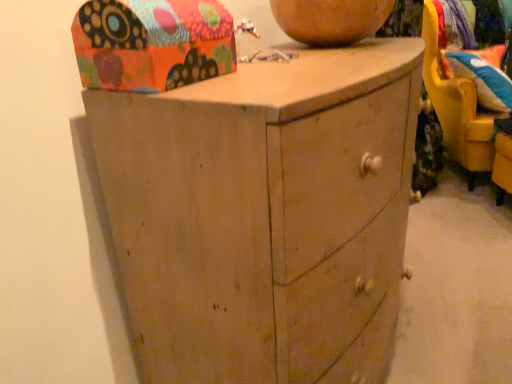
This screenshot has width=512, height=384. Describe the element at coordinates (330, 20) in the screenshot. I see `matte brown vase at upper center` at that location.

What do you see at coordinates (482, 80) in the screenshot? This screenshot has height=384, width=512. I see `velvet blue pillow at right` at bounding box center [482, 80].

Looking at this image, what is the approximate height of matte wood chest of drawers at center?

It is 38.85 inches.

The image size is (512, 384). Describe the element at coordinates (426, 148) in the screenshot. I see `floral fabric cushion at upper right` at that location.

In the scene shown: What is the approximate width of multicolored paper shoe box at upper left?

6.96 inches.

Where is `matte brown vase at upper center`? matte brown vase at upper center is located at coordinates (330, 20).

I want to click on swivel chair that is on the right side of floral fabric cushion at upper right, so click(456, 106).

Based on the photo, is floral fabric cushion at upper right positioned behind yellow plastic swivel chair at right?

No.

Who is bigger, floral fabric cushion at upper right or yellow plastic swivel chair at right?

yellow plastic swivel chair at right.

From the image's perspective, is floral fabric cushion at upper right above or below yellow plastic swivel chair at right?

floral fabric cushion at upper right is below yellow plastic swivel chair at right.

Looking at this image, which object is further away from the camera, floral fabric cushion at upper right or velvet blue pillow at right?

velvet blue pillow at right.

Would you say floral fabric cushion at upper right is a long distance from velvet blue pillow at right?

No.

Is floral fabric cushion at upper right wider or thinner than velvet blue pillow at right?

Considering their sizes, floral fabric cushion at upper right looks slimmer than velvet blue pillow at right.

From a real-world perspective, is matte brown vase at upper center above or below matte wood chest of drawers at center?

matte brown vase at upper center is above matte wood chest of drawers at center.

Is matte brown vase at upper center positioned before matte wood chest of drawers at center?

No, the depth of matte brown vase at upper center is greater than that of matte wood chest of drawers at center.

Considering the relative positions of matte brown vase at upper center and matte wood chest of drawers at center in the image provided, is matte brown vase at upper center to the left of matte wood chest of drawers at center from the viewer's perspective?

No, matte brown vase at upper center is not to the left of matte wood chest of drawers at center.

Where is `pillow behind the multicolored paper shoe box at upper left`? This screenshot has width=512, height=384. pillow behind the multicolored paper shoe box at upper left is located at coordinates (482, 80).

From a real-world perspective, between multicolored paper shoe box at upper left and velvet blue pillow at right, who is vertically higher?

In real-world perspective, multicolored paper shoe box at upper left is above.

Is multicolored paper shoe box at upper left taller or shorter than velvet blue pillow at right?

Considering their sizes, multicolored paper shoe box at upper left has less height than velvet blue pillow at right.

Considering the points (337, 14) and (467, 78), which point is behind, point (337, 14) or point (467, 78)?

Positioned behind is point (467, 78).

Is matte brown vase at upper center oriented away from velvet blue pillow at right?

No, matte brown vase at upper center is not facing away from velvet blue pillow at right.

Who is smaller, matte brown vase at upper center or velvet blue pillow at right?

matte brown vase at upper center.

Does matte brown vase at upper center have a lesser width compared to velvet blue pillow at right?

Indeed, matte brown vase at upper center has a lesser width compared to velvet blue pillow at right.

Does floral fabric cushion at upper right have a smaller size compared to multicolored paper shoe box at upper left?

Incorrect, floral fabric cushion at upper right is not smaller in size than multicolored paper shoe box at upper left.

Based on the photo, in terms of width, does floral fabric cushion at upper right look wider or thinner when compared to multicolored paper shoe box at upper left?

floral fabric cushion at upper right is wider than multicolored paper shoe box at upper left.

Locate an element on the screen. Image resolution: width=512 pixels, height=384 pixels. shoe box in front of the floral fabric cushion at upper right is located at coordinates (152, 43).

Can you confirm if matte wood chest of drawers at center is taller than matte brown vase at upper center?

Indeed, matte wood chest of drawers at center has a greater height compared to matte brown vase at upper center.

What's the angular difference between matte wood chest of drawers at center and matte brown vase at upper center's facing directions?

matte wood chest of drawers at center and matte brown vase at upper center are facing 0.702 degrees away from each other.

Is matte wood chest of drawers at center oriented towards matte brown vase at upper center?

No.

Identify the location of the chest of drawers in front of the matte brown vase at upper center. (264, 215).

The image size is (512, 384). Identify the location of swivel chair behind the floral fabric cushion at upper right. (456, 106).

Where is `pillow on the right of the floral fabric cushion at upper right`? The height and width of the screenshot is (384, 512). pillow on the right of the floral fabric cushion at upper right is located at coordinates (482, 80).

Considering their positions, is matte wood chest of drawers at center positioned closer to multicolored paper shoe box at upper left than matte brown vase at upper center?

matte wood chest of drawers at center is positioned closer to the anchor multicolored paper shoe box at upper left.

Considering their positions, is velvet blue pillow at right positioned further to matte brown vase at upper center than yellow plastic swivel chair at right?

Based on the image, yellow plastic swivel chair at right appears to be further to matte brown vase at upper center.

Estimate the real-world distances between objects in this image. Which object is further from matte brown vase at upper center, floral fabric cushion at upper right or yellow plastic swivel chair at right?

yellow plastic swivel chair at right is further to matte brown vase at upper center.

When comparing their distances from floral fabric cushion at upper right, does matte wood chest of drawers at center or velvet blue pillow at right seem further?

matte wood chest of drawers at center.

When comparing their distances from matte wood chest of drawers at center, does multicolored paper shoe box at upper left or yellow plastic swivel chair at right seem closer?

The object closer to matte wood chest of drawers at center is multicolored paper shoe box at upper left.

Looking at the image, which one is located further to multicolored paper shoe box at upper left, matte brown vase at upper center or velvet blue pillow at right?

velvet blue pillow at right lies further to multicolored paper shoe box at upper left than the other object.

From the image, which object appears to be nearer to floral fabric cushion at upper right, yellow plastic swivel chair at right or matte brown vase at upper center?

yellow plastic swivel chair at right is positioned closer to the anchor floral fabric cushion at upper right.

Looking at the image, which one is located closer to floral fabric cushion at upper right, matte brown vase at upper center or yellow plastic swivel chair at right?

yellow plastic swivel chair at right is positioned closer to the anchor floral fabric cushion at upper right.

In order to click on vase between multicolored paper shoe box at upper left and velvet blue pillow at right along the z-axis in this screenshot , I will do `click(330, 20)`.

The image size is (512, 384). Find the location of `vase positioned between matte wood chest of drawers at center and yellow plastic swivel chair at right from near to far`. vase positioned between matte wood chest of drawers at center and yellow plastic swivel chair at right from near to far is located at coordinates (330, 20).

Locate an element on the screen. Image resolution: width=512 pixels, height=384 pixels. swivel chair located between floral fabric cushion at upper right and velvet blue pillow at right in the left-right direction is located at coordinates (456, 106).

Identify the location of clothing between matte wood chest of drawers at center and yellow plastic swivel chair at right along the z-axis. (426, 148).